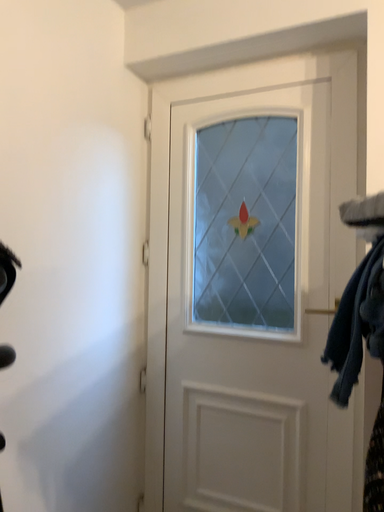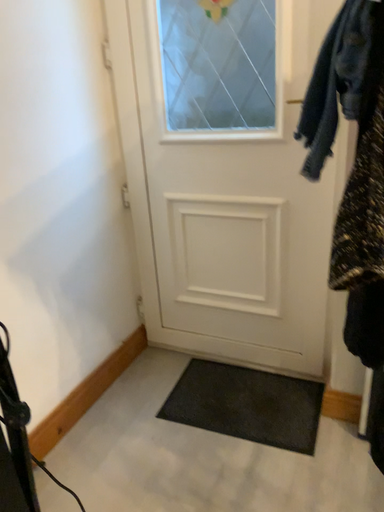
Question: How did the camera likely rotate when shooting the video?

Choices:
 (A) rotated downward
 (B) rotated upward

Answer: (A)